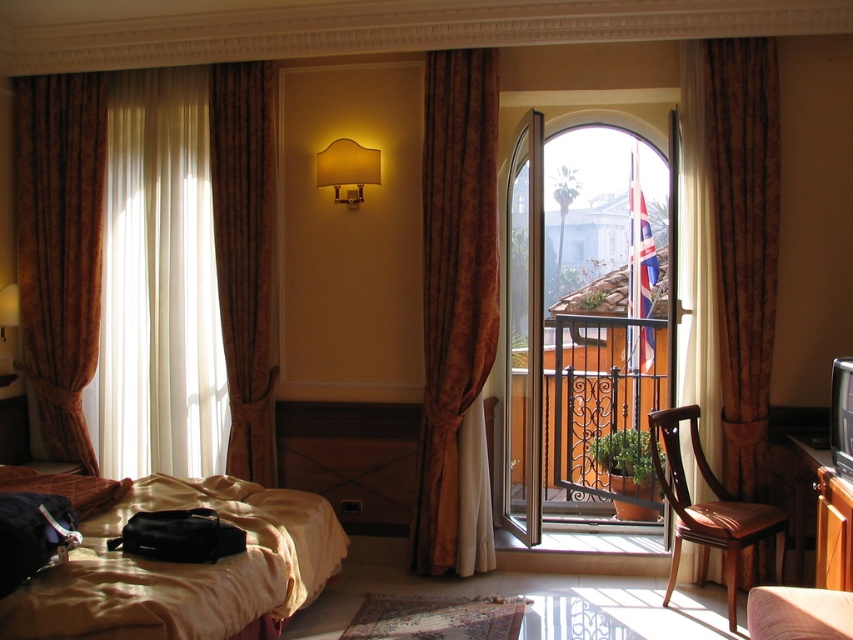
You are a guest in the hotel room and want to open the curtains to let in more light. Which curtain, the gold textured curtain at left or the brown textured curtain at left, should you pull to the side to achieve this?

The gold textured curtain at left is wider than the brown textured curtain at left, so pulling the gold textured curtain at left to the side would allow more light into the room.